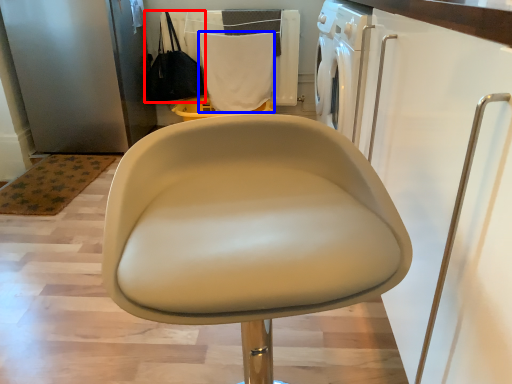
Question: Which of the following is the farthest to the observer, handbag (highlighted by a red box) or cloth (highlighted by a blue box)?

Choices:
 (A) handbag
 (B) cloth

Answer: (B)